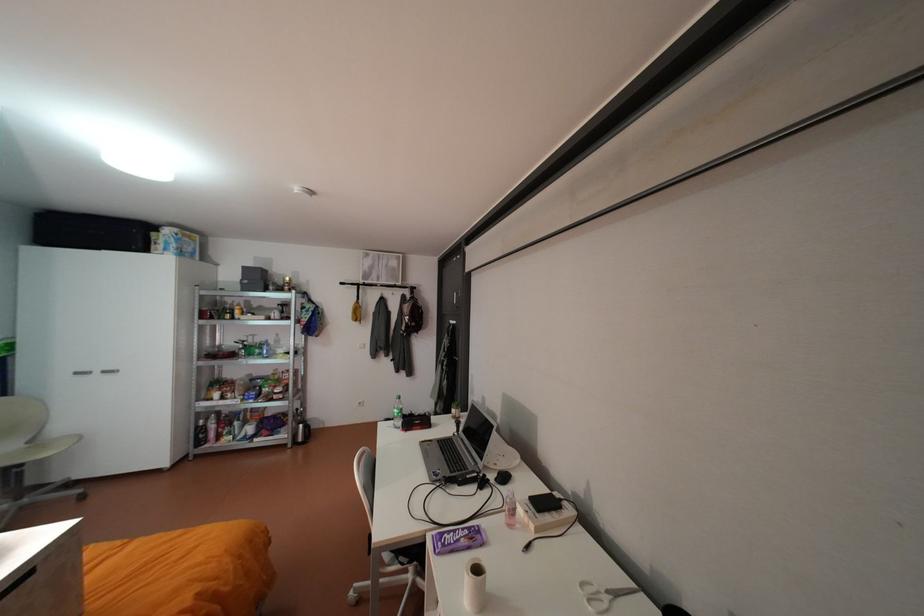
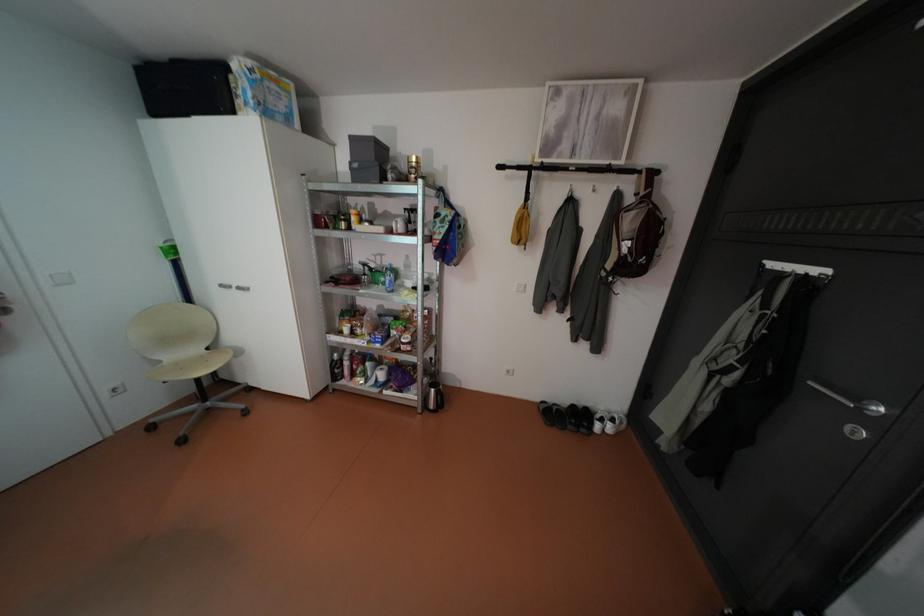
The point at (416, 320) is marked in the first image. Where is the corresponding point in the second image?

(634, 249)